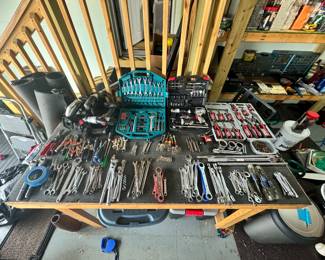
What are the coordinates of `mats` in the screenshot? It's located at (47, 94).